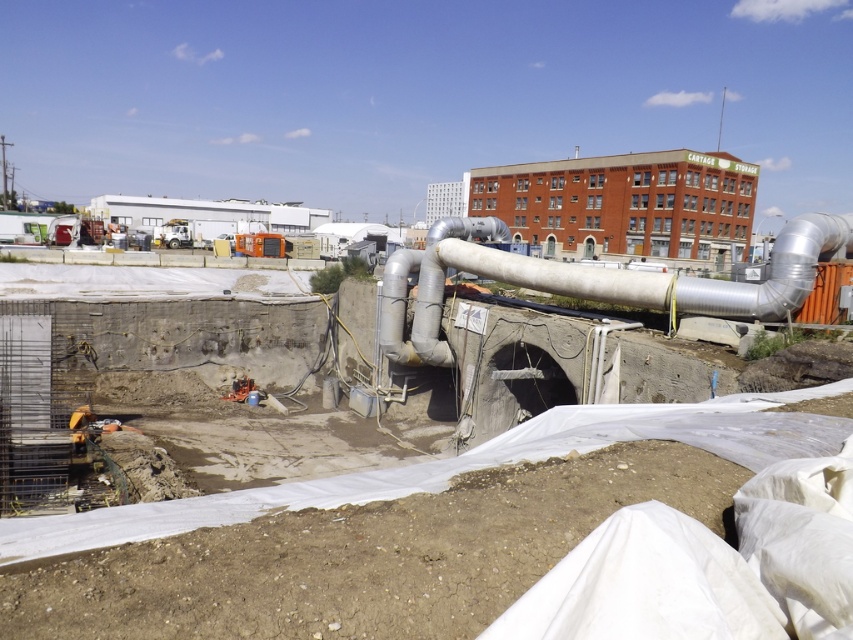
Question: Is concrete wall at center to the right of silver metallic pipe at center from the viewer's perspective?

Choices:
 (A) no
 (B) yes

Answer: (A)

Question: Does concrete wall at center appear under silver metallic pipe at center?

Choices:
 (A) no
 (B) yes

Answer: (B)

Question: Which point is closer to the camera?

Choices:
 (A) silver metallic pipe at center
 (B) concrete wall at center

Answer: (B)

Question: Where is concrete wall at center located in relation to silver metallic pipe at center in the image?

Choices:
 (A) right
 (B) left

Answer: (B)